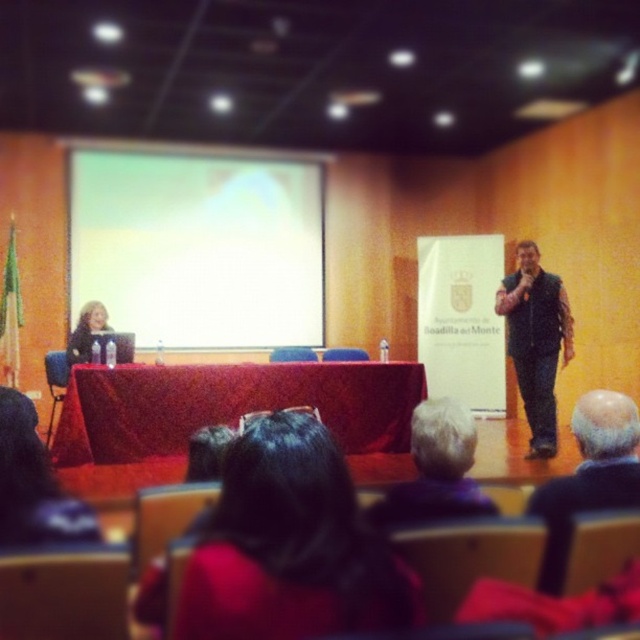
Question: Is gray fabric jacket at center wider than matte black laptop at left?

Choices:
 (A) no
 (B) yes

Answer: (A)

Question: Among these objects, which one is farthest from the camera?

Choices:
 (A) matte black laptop at left
 (B) gray hair at center
 (C) gray fabric jacket at center

Answer: (A)

Question: Among these objects, which one is nearest to the camera?

Choices:
 (A) white matte projection screen at upper center
 (B) gray hair at center
 (C) black leather jacket at center
 (D) dark hair at center

Answer: (D)

Question: Can you confirm if white matte projection screen at upper center is thinner than gray fabric jacket at center?

Choices:
 (A) no
 (B) yes

Answer: (A)

Question: Is dark hair at center closer to camera compared to black leather jacket at center?

Choices:
 (A) yes
 (B) no

Answer: (A)

Question: Which point is closer to the camera taking this photo?

Choices:
 (A) (84, 332)
 (B) (620, 468)

Answer: (B)